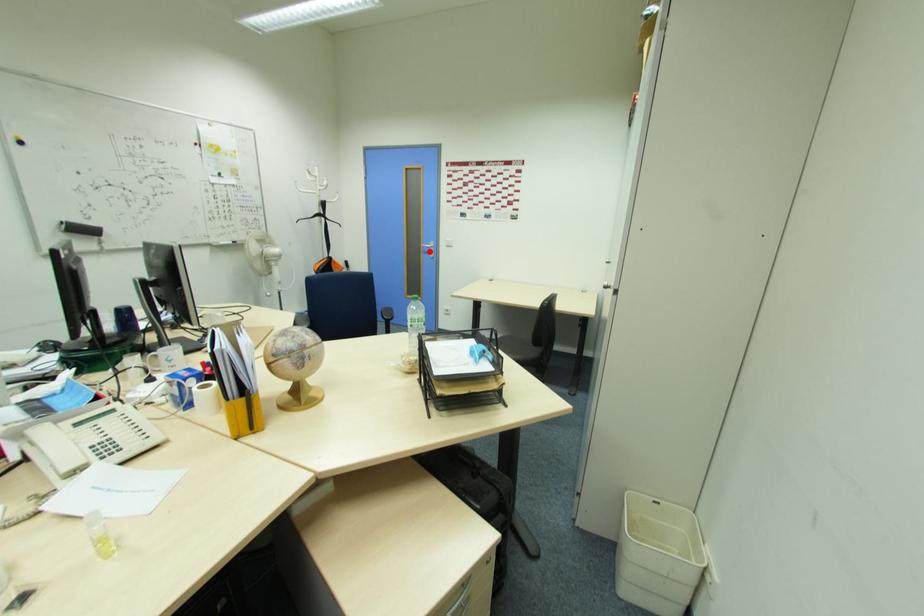
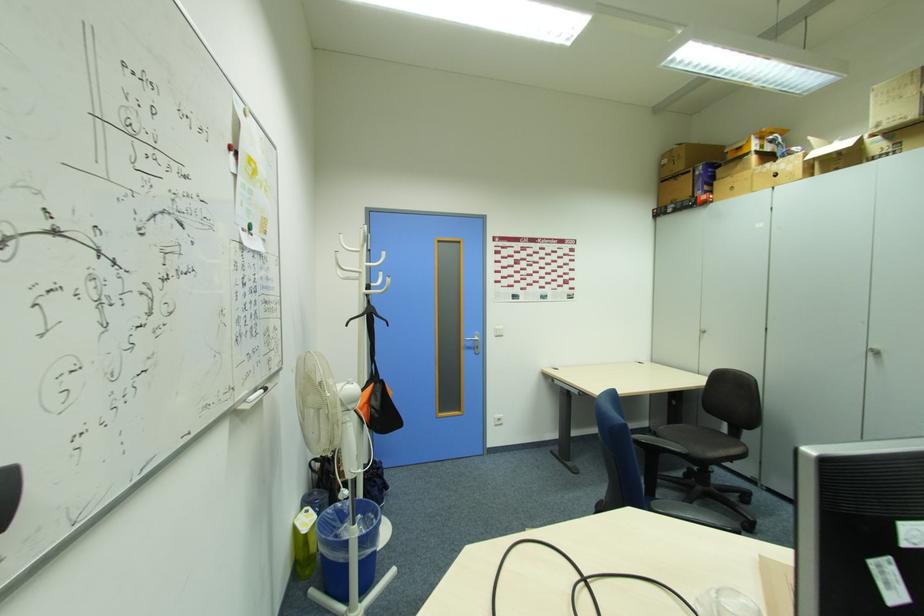
Where in the second image is the point corresponding to the highlighted location from the first image?

(472, 346)